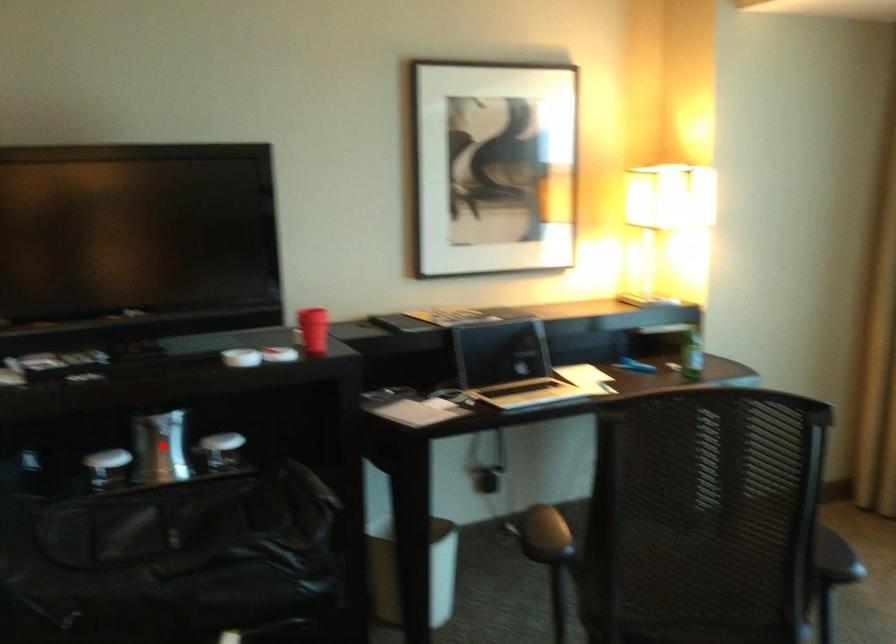
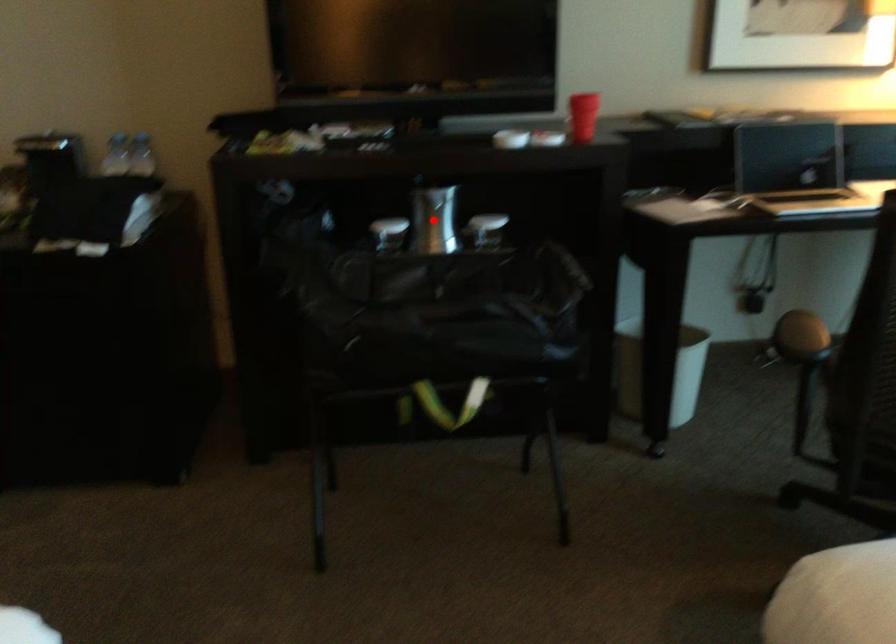
I am providing you with two images of the same scene from different viewpoints. A red point is marked on the first image and another point is marked on the second image. Do the highlighted points in image1 and image2 indicate the same real-world spot?

Yes